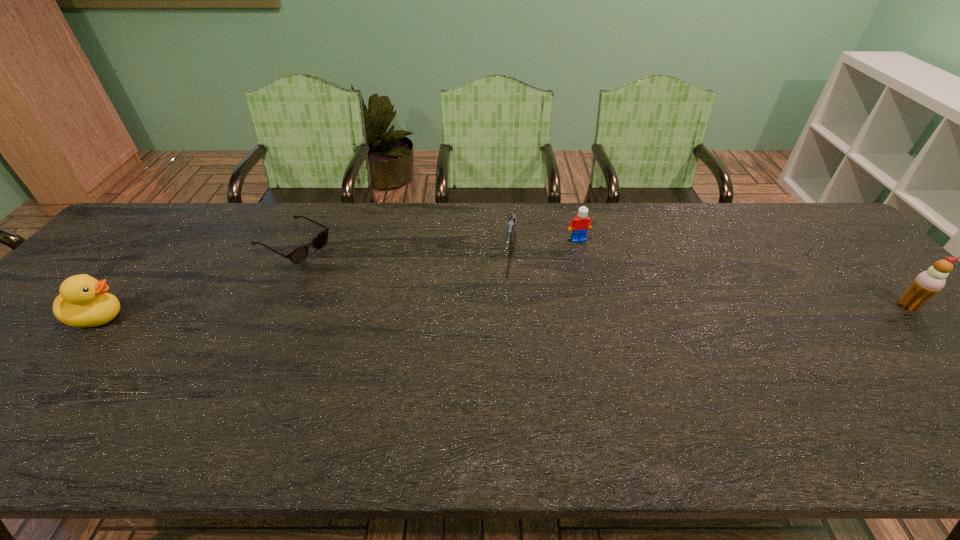
The width and height of the screenshot is (960, 540). Find the location of `duck`. duck is located at coordinates (83, 302).

You are a GUI agent. You are given a task and a screenshot of the screen. Output one action in this format:
    pyautogui.click(x=<x>, y=<y>)
    Task: Click on the icecream
    The height and width of the screenshot is (540, 960).
    Given the screenshot: What is the action you would take?
    pyautogui.click(x=928, y=283)

Image resolution: width=960 pixels, height=540 pixels. What are the coordinates of `the rightmost object` in the screenshot? It's located at (928, 283).

The image size is (960, 540). Identify the location of the third object from left to right. (512, 220).

Identify the location of the shortest object. The image size is (960, 540). (298, 255).

What are the coordinates of `the second object from left to right` in the screenshot? It's located at (298, 255).

I want to click on Lego, so click(x=581, y=223).

The image size is (960, 540). What are the coordinates of `blank space located 0.390m at the beak of the leftmost object` in the screenshot? It's located at (280, 317).

Identify the location of vacant space situated at the front with a straw on the tallest object. (940, 338).

The image size is (960, 540). Find the location of `vacant space located at the barrel of the third object from left to right`. vacant space located at the barrel of the third object from left to right is located at coordinates (505, 309).